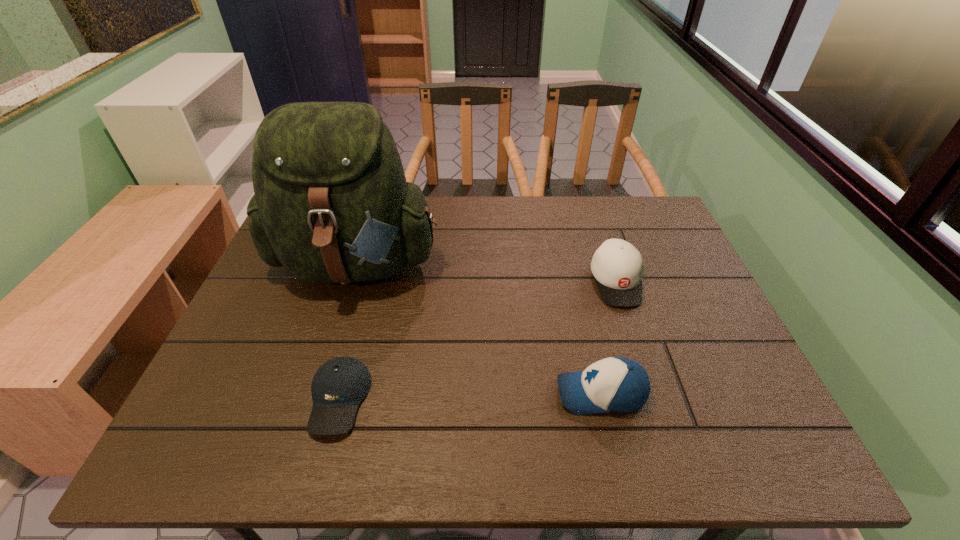
Find the location of a particular element. backpack is located at coordinates (331, 204).

Image resolution: width=960 pixels, height=540 pixels. Find the location of `the farthest baseball cap`. the farthest baseball cap is located at coordinates (617, 266).

Image resolution: width=960 pixels, height=540 pixels. I want to click on the leftmost baseball cap, so click(x=340, y=384).

This screenshot has height=540, width=960. What are the coordinates of `the shortest object` in the screenshot? It's located at (340, 384).

Where is `free space located 0.300m on the open flap of the tallest object`? This screenshot has height=540, width=960. free space located 0.300m on the open flap of the tallest object is located at coordinates (308, 422).

Locate an element on the screen. This screenshot has height=540, width=960. vacant space located 0.070m on the front-facing side of the farthest baseball cap is located at coordinates (632, 330).

This screenshot has width=960, height=540. Identify the location of object that is at the far edge. (331, 204).

In order to click on object that is positioned at the near edge in this screenshot , I will do `click(340, 384)`.

Where is `object that is at the left edge`? object that is at the left edge is located at coordinates (331, 204).

Find the location of a particular element. object that is at the right edge is located at coordinates (617, 266).